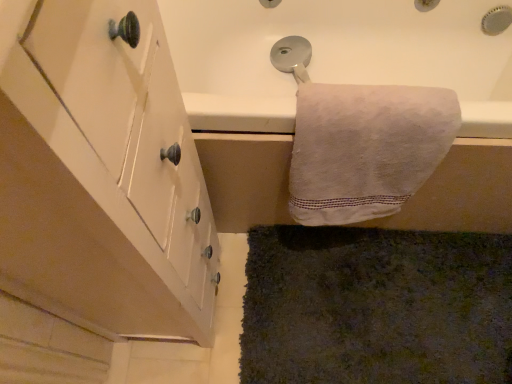
Locate an element on the screen. Image resolution: width=512 pixels, height=384 pixels. white matte cabinet at left is located at coordinates (102, 173).

Describe the element at coordinates (376, 307) in the screenshot. Image resolution: width=512 pixels, height=384 pixels. I see `dark green shaggy carpet at lower right` at that location.

This screenshot has width=512, height=384. Describe the element at coordinates (365, 149) in the screenshot. I see `white cotton towel at upper right` at that location.

Where is `white matte cabinet at left`? white matte cabinet at left is located at coordinates (102, 173).

What's the angular difference between white cotton towel at upper right and white matte cabinet at left's facing directions?

There is a 89.5-degree angle between the facing directions of white cotton towel at upper right and white matte cabinet at left.

Is point (432, 129) positioned after point (16, 123)?

Yes.

How far apart are white cotton towel at upper right and white matte cabinet at left?

12.90 inches.

Is white cotton towel at upper right positioned beyond the bounds of white matte cabinet at left?

Yes, white cotton towel at upper right is outside of white matte cabinet at left.

Is dark green shaggy carpet at lower right not near white cotton towel at upper right?

dark green shaggy carpet at lower right is near white cotton towel at upper right, not far away.

From the image's perspective, is dark green shaggy carpet at lower right beneath white cotton towel at upper right?

Yes, from the image's perspective, dark green shaggy carpet at lower right is below white cotton towel at upper right.

Does point (486, 277) come in front of point (420, 150)?

No.

Would you say dark green shaggy carpet at lower right is outside white cotton towel at upper right?

Absolutely, dark green shaggy carpet at lower right is external to white cotton towel at upper right.

Is white matte cabinet at left positioned far away from dark green shaggy carpet at lower right?

No, white matte cabinet at left is not far from dark green shaggy carpet at lower right.

From the picture: From the image's perspective, is white matte cabinet at left located above dark green shaggy carpet at lower right?

Yes.

Looking at their sizes, would you say white matte cabinet at left is wider or thinner than dark green shaggy carpet at lower right?

white matte cabinet at left is thinner than dark green shaggy carpet at lower right.

From a real-world perspective, which is physically below, white matte cabinet at left or dark green shaggy carpet at lower right?

dark green shaggy carpet at lower right is physically lower.

In the image, there is a white cotton towel at upper right. At what (x,y) coordinates should I click in order to perform the action: click on cabinetry below it (from the image's perspective). Please return your answer as a coordinate pair (x, y). The height and width of the screenshot is (384, 512). Looking at the image, I should click on (102, 173).

From the image's perspective, which object appears higher, white matte cabinet at left or white cotton towel at upper right?

white cotton towel at upper right, from the image's perspective.

Are white matte cabinet at left and white cotton towel at upper right located far from each other?

No, white matte cabinet at left is in close proximity to white cotton towel at upper right.

Is white cotton towel at upper right at the right side of dark green shaggy carpet at lower right?

No.

From the picture: Considering their positions, is white cotton towel at upper right located in front of or behind dark green shaggy carpet at lower right?

white cotton towel at upper right is positioned closer to the viewer than dark green shaggy carpet at lower right.

From the image's perspective, would you say white cotton towel at upper right is shown under dark green shaggy carpet at lower right?

No, from the image's perspective, white cotton towel at upper right is not below dark green shaggy carpet at lower right.

Is white cotton towel at upper right situated inside dark green shaggy carpet at lower right or outside?

white cotton towel at upper right is spatially situated outside dark green shaggy carpet at lower right.

Considering the relative sizes of dark green shaggy carpet at lower right and white matte cabinet at left in the image provided, is dark green shaggy carpet at lower right bigger than white matte cabinet at left?

No.

In order to click on cabinetry that appears above the dark green shaggy carpet at lower right (from a real-world perspective) in this screenshot , I will do `click(102, 173)`.

Can you confirm if dark green shaggy carpet at lower right is taller than white matte cabinet at left?

No, dark green shaggy carpet at lower right is not taller than white matte cabinet at left.

Does point (313, 239) come in front of point (53, 289)?

No, it is not.

The width and height of the screenshot is (512, 384). I want to click on cabinetry on the left of white cotton towel at upper right, so click(102, 173).

What are the coordinates of `bath mat below the white cotton towel at upper right (from a real-world perspective)` in the screenshot? It's located at (376, 307).

When comparing their distances from dark green shaggy carpet at lower right, does white matte cabinet at left or white cotton towel at upper right seem closer?

Among the two, white cotton towel at upper right is located nearer to dark green shaggy carpet at lower right.

From the image, which object appears to be nearer to white matte cabinet at left, dark green shaggy carpet at lower right or white cotton towel at upper right?

The object closer to white matte cabinet at left is white cotton towel at upper right.

Looking at the image, which one is located further to dark green shaggy carpet at lower right, white cotton towel at upper right or white matte cabinet at left?

Based on the image, white matte cabinet at left appears to be further to dark green shaggy carpet at lower right.

From the image, which object appears to be farther from white cotton towel at upper right, dark green shaggy carpet at lower right or white matte cabinet at left?

Among the two, dark green shaggy carpet at lower right is located further to white cotton towel at upper right.

Estimate the real-world distances between objects in this image. Which object is closer to white cotton towel at upper right, white matte cabinet at left or dark green shaggy carpet at lower right?

Among the two, white matte cabinet at left is located nearer to white cotton towel at upper right.

Estimate the real-world distances between objects in this image. Which object is closer to white matte cabinet at left, white cotton towel at upper right or dark green shaggy carpet at lower right?

white cotton towel at upper right is positioned closer to the anchor white matte cabinet at left.

The width and height of the screenshot is (512, 384). In order to click on towel positioned between white matte cabinet at left and dark green shaggy carpet at lower right from near to far in this screenshot , I will do `click(365, 149)`.